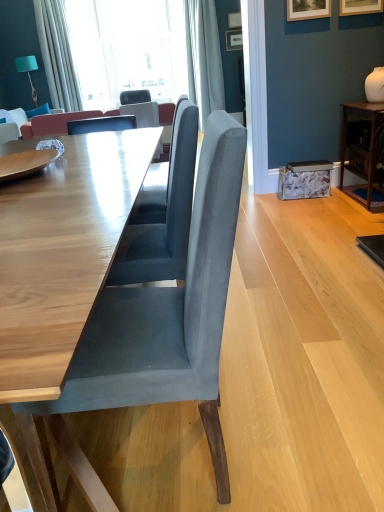
Where is `free location to the right of suede gray chair at center, the first chair from the bottom`? This screenshot has height=512, width=384. free location to the right of suede gray chair at center, the first chair from the bottom is located at coordinates (300, 422).